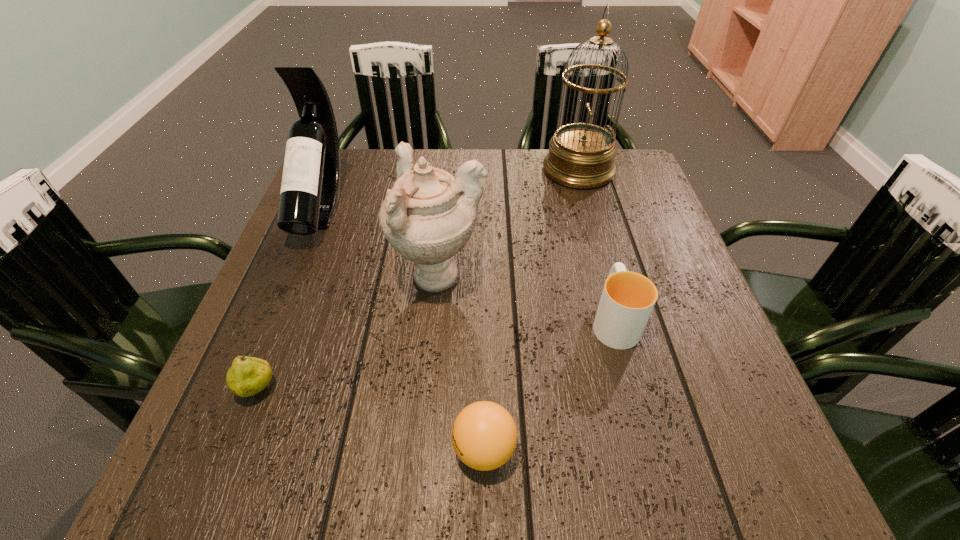
Locate an element on the screen. the second closest object to the cup is located at coordinates (484, 435).

In order to click on object that is the fifth closest to the birdcage in this screenshot , I will do `click(247, 376)`.

Find the location of a particular element. Image resolution: width=960 pixels, height=540 pixels. blank space that satisfies the following two spatial constraints: 1. with an open door on the birdcage; 2. on the stand of the wine bottle is located at coordinates (589, 208).

In order to click on free space that satisfies the following two spatial constraints: 1. with an open door on the birdcage; 2. on the stand of the wine bottle in this screenshot , I will do tap(589, 208).

At what (x,y) coordinates should I click in order to perform the action: click on blank area in the image that satisfies the following two spatial constraints: 1. on the stand of the pear; 2. on the right side of the wine bottle. Please return your answer as a coordinate pair (x, y). The height and width of the screenshot is (540, 960). Looking at the image, I should click on (247, 389).